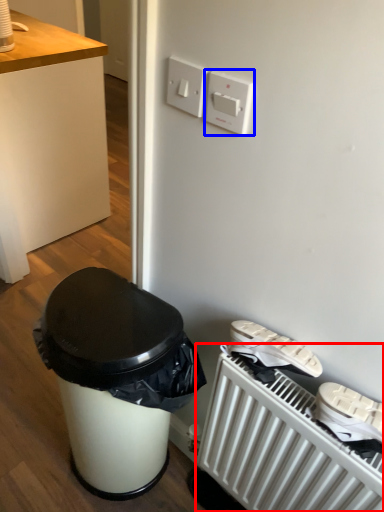
Question: Which of the following is the closest to the observer, radiator (highlighted by a red box) or light switch (highlighted by a blue box)?

Choices:
 (A) radiator
 (B) light switch

Answer: (B)